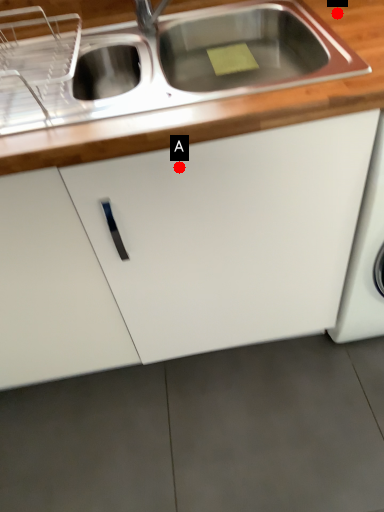
Question: Two points are circled on the image, labeled by A and B beside each circle. Among these points, which one is nearest to the camera?

Choices:
 (A) A is closer
 (B) B is closer

Answer: (A)